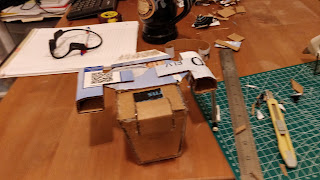
The height and width of the screenshot is (180, 320). Identify the location of hot glue gun. (86, 1), (313, 44).